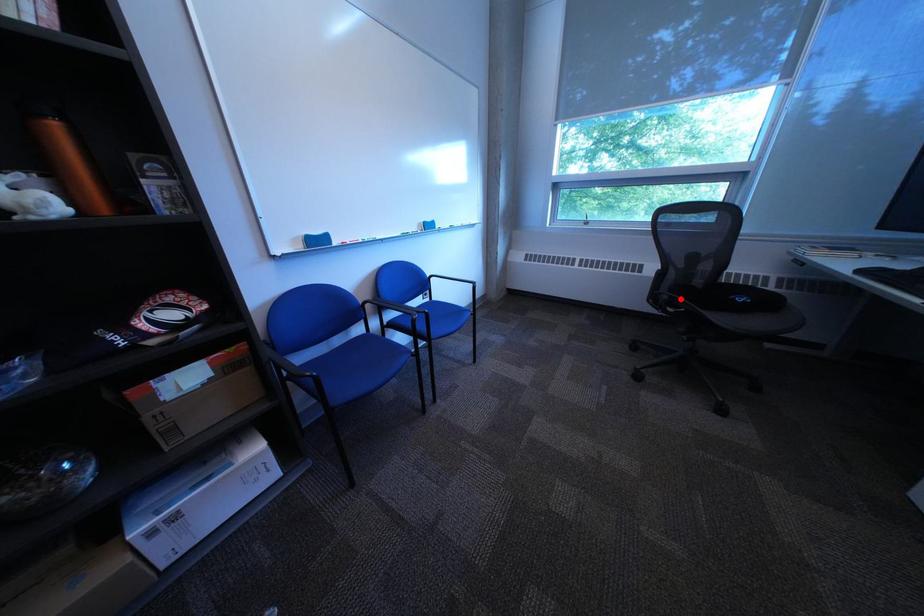
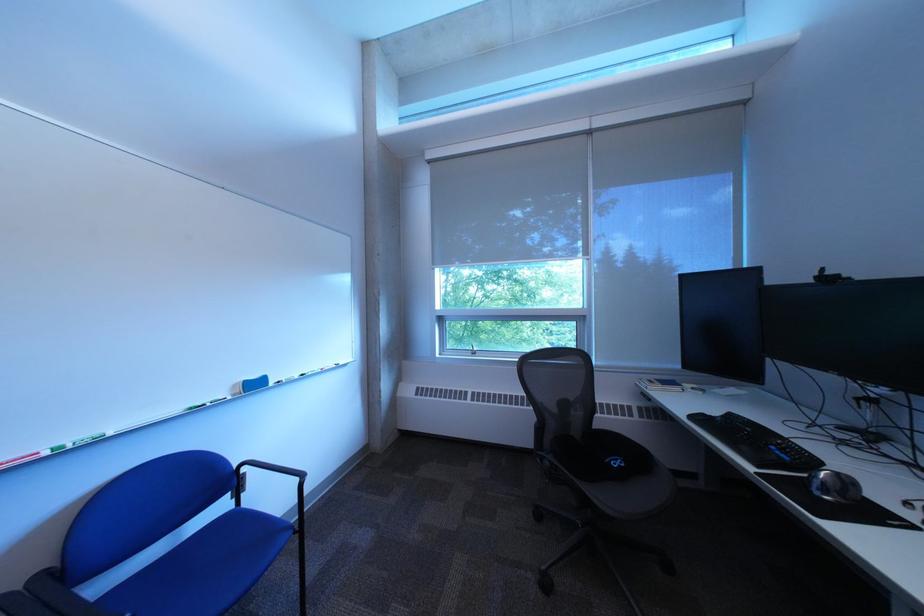
Question: I am providing you with two images of the same scene from different viewpoints. Image1 has a red point marked. In image2, the corresponding 3D location appears at what relative position? Reply with the corresponding letter.

Choices:
 (A) Closer
 (B) Farther

Answer: (B)